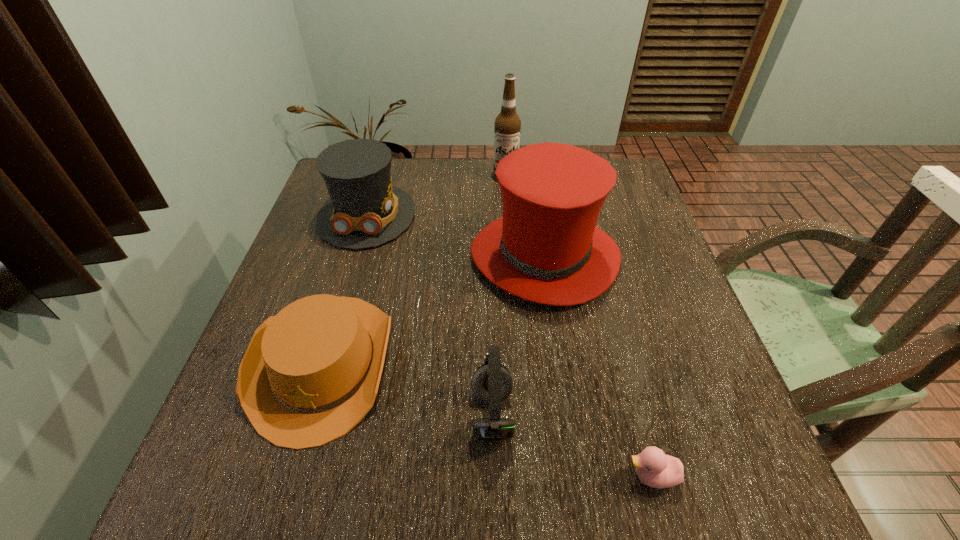
Where is `unoccupied area between the duckling and the farthest object`? The image size is (960, 540). unoccupied area between the duckling and the farthest object is located at coordinates (579, 325).

Where is `vacant area that lies between the right dress hat and the headset`? This screenshot has height=540, width=960. vacant area that lies between the right dress hat and the headset is located at coordinates (518, 335).

Identify the location of object that is the nearest to the shortest object. (492, 383).

Find the location of a particular element. the third closest object to the shorter dress hat is located at coordinates (507, 127).

What are the coordinates of `vacant position in the image that satisfies the following two spatial constraints: 1. with goggles on the front of the right dress hat; 2. on the left side of the left dress hat` in the screenshot? It's located at [x=354, y=256].

You are a GUI agent. You are given a task and a screenshot of the screen. Output one action in this format:
    pyautogui.click(x=<x>, y=<y>)
    Task: Click on the vacant area in the image that satisfies the following two spatial constraints: 1. on the label of the alcohol; 2. on the ear cups of the headset
    This screenshot has width=960, height=540.
    Given the screenshot: What is the action you would take?
    pyautogui.click(x=523, y=415)